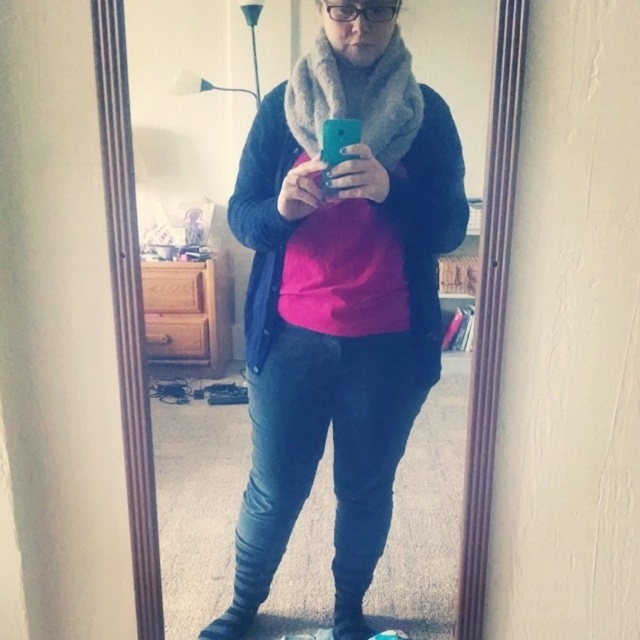
Question: Is fuzzy gray scarf at upper center in front of gray woolen scarf at center?

Choices:
 (A) yes
 (B) no

Answer: (A)

Question: Which point is closer to the camera taking this photo?

Choices:
 (A) (416, 109)
 (B) (467, 580)

Answer: (A)

Question: Is fuzzy gray scarf at upper center further to camera compared to gray woolen scarf at center?

Choices:
 (A) yes
 (B) no

Answer: (B)

Question: Does fuzzy gray scarf at upper center have a smaller size compared to gray woolen scarf at center?

Choices:
 (A) yes
 (B) no

Answer: (B)